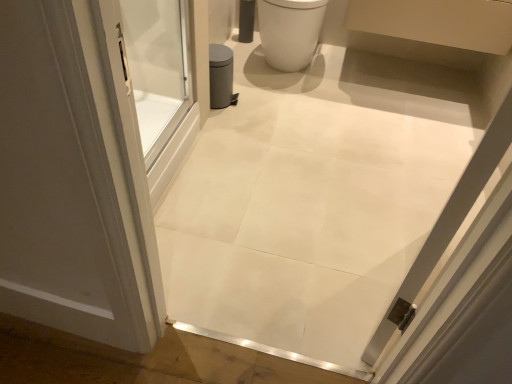
Describe the element at coordinates (290, 31) in the screenshot. I see `white glossy toilet bowl at upper right` at that location.

In order to click on white glossy toilet bowl at upper right in this screenshot , I will do `click(290, 31)`.

Image resolution: width=512 pixels, height=384 pixels. I want to click on white glossy toilet bowl at upper right, so click(290, 31).